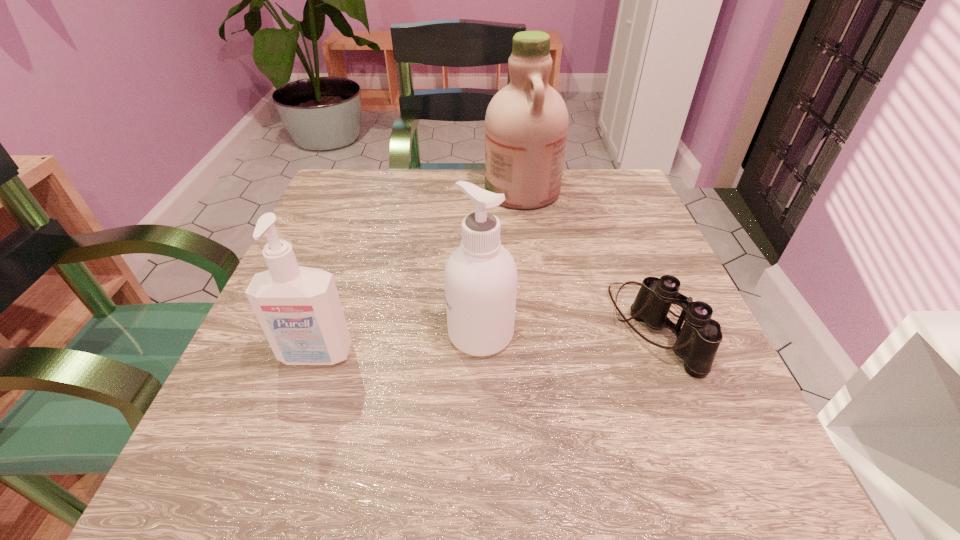
At what (x,y) coordinates should I click in order to perform the action: click on the closest object relative to the farthest object. Please return your answer as a coordinate pair (x, y). Looking at the image, I should click on (697, 342).

Image resolution: width=960 pixels, height=540 pixels. Identify the location of the third closest object to the rightmost object. (299, 309).

At what (x,y) coordinates should I click in order to perform the action: click on the closest cleansing agent to the rightmost object. Please return your answer as a coordinate pair (x, y). This screenshot has width=960, height=540. Looking at the image, I should click on (x=480, y=277).

At what (x,y) coordinates should I click in order to perform the action: click on cleansing agent that is the second closest to the tallest cleansing agent. Please return your answer as a coordinate pair (x, y). This screenshot has width=960, height=540. Looking at the image, I should click on (299, 309).

Identify the location of vacant space that satisfies the following two spatial constraints: 1. on the front label of the rightmost object; 2. on the right side of the farthest object. (540, 328).

What are the coordinates of `vacant position in the image that satisfies the following two spatial constraints: 1. on the front label of the tallest cleansing agent; 2. on the right side of the rightmost object` in the screenshot? It's located at (540, 328).

The width and height of the screenshot is (960, 540). Find the location of `vacant area in the image that satisfies the following two spatial constraints: 1. on the front label of the tallest cleansing agent; 2. on the left side of the shortest object`. vacant area in the image that satisfies the following two spatial constraints: 1. on the front label of the tallest cleansing agent; 2. on the left side of the shortest object is located at coordinates (540, 328).

In order to click on vacant space that satisfies the following two spatial constraints: 1. on the front label of the farthest cleansing agent; 2. on the front label of the leftmost object in this screenshot , I will do `click(544, 355)`.